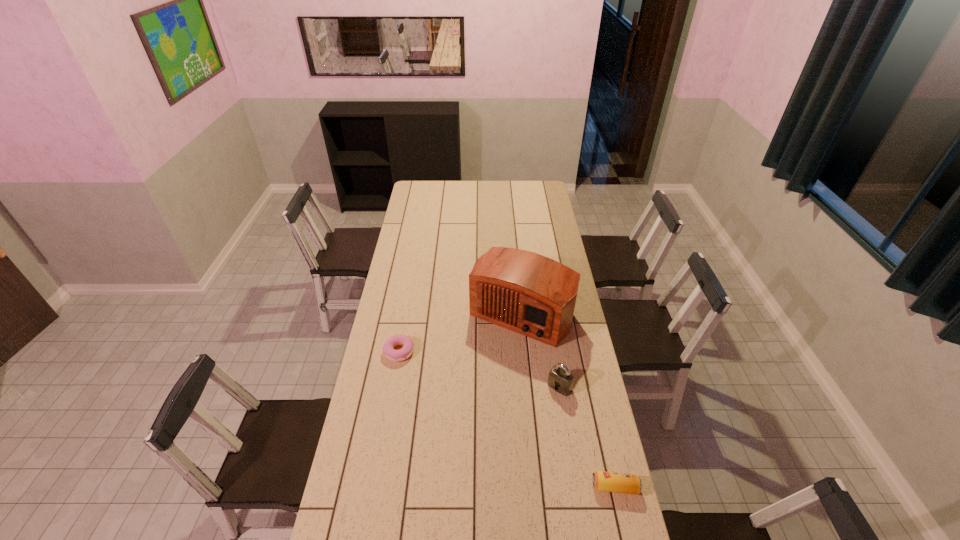
Image resolution: width=960 pixels, height=540 pixels. I want to click on pastry, so click(394, 355).

I want to click on the leftmost object, so pos(394,355).

At what (x,y) coordinates should I click in order to perform the action: click on beer can. Please return your answer as a coordinate pair (x, y). The image size is (960, 540). Looking at the image, I should click on (603, 481).

This screenshot has height=540, width=960. I want to click on the second shortest object, so point(603,481).

Find the location of `radio receiver`. radio receiver is located at coordinates (525, 292).

I want to click on the third farthest object, so click(x=560, y=379).

Where is `padlock`? This screenshot has height=540, width=960. padlock is located at coordinates (560, 379).

The image size is (960, 540). Identify the location of vacant area situated on the back of the shortest object. (405, 316).

Where is `vacant region located on the left of the nearest object`? The height and width of the screenshot is (540, 960). vacant region located on the left of the nearest object is located at coordinates (534, 487).

Where is `vacant space situated 0.260m on the front-facing side of the tallest object`? vacant space situated 0.260m on the front-facing side of the tallest object is located at coordinates (x=469, y=389).